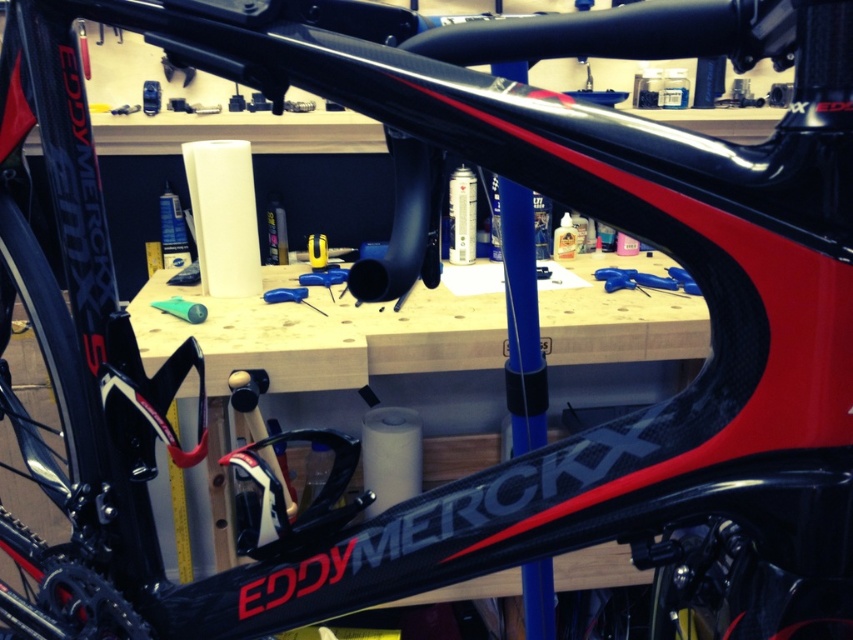
Question: Can you confirm if blue rubber handlebar tape at center is positioned to the right of green rubber tube at center?

Choices:
 (A) no
 (B) yes

Answer: (B)

Question: Which point is closer to the camera taking this photo?

Choices:
 (A) (608, 273)
 (B) (192, 301)
 (C) (74, 602)

Answer: (C)

Question: Does black rubber tire at lower left have a smaller size compared to blue rubber handlebar tape at center?

Choices:
 (A) no
 (B) yes

Answer: (A)

Question: Considering the relative positions of black rubber tire at lower left and blue rubber handlebar tape at center in the image provided, where is black rubber tire at lower left located with respect to blue rubber handlebar tape at center?

Choices:
 (A) right
 (B) left

Answer: (B)

Question: Which is nearer to the black rubber tire at lower left?

Choices:
 (A) blue rubber handlebar tape at center
 (B) green rubber tube at center

Answer: (B)

Question: Which object appears farthest from the camera in this image?

Choices:
 (A) black rubber tire at lower left
 (B) blue rubber handlebar tape at center

Answer: (B)